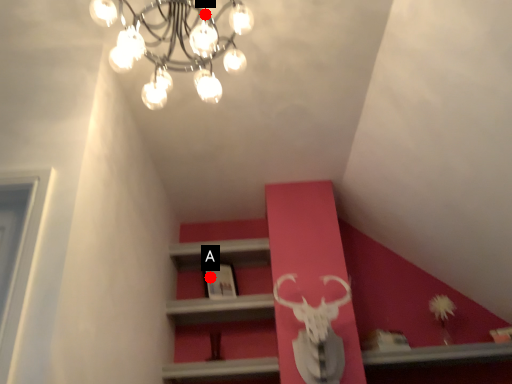
Question: Two points are circled on the image, labeled by A and B beside each circle. Which point is closer to the camera?

Choices:
 (A) A is closer
 (B) B is closer

Answer: (B)